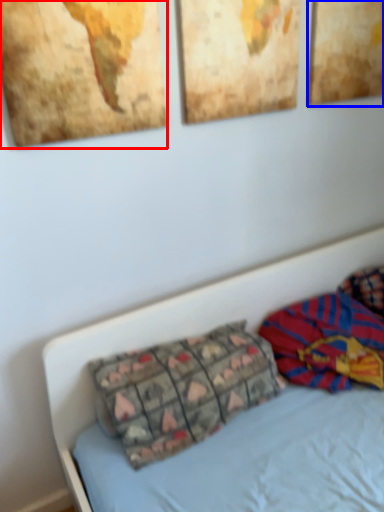
Question: Which of the following is the farthest to the observer, picture frame (highlighted by a red box) or picture frame (highlighted by a blue box)?

Choices:
 (A) picture frame
 (B) picture frame

Answer: (B)